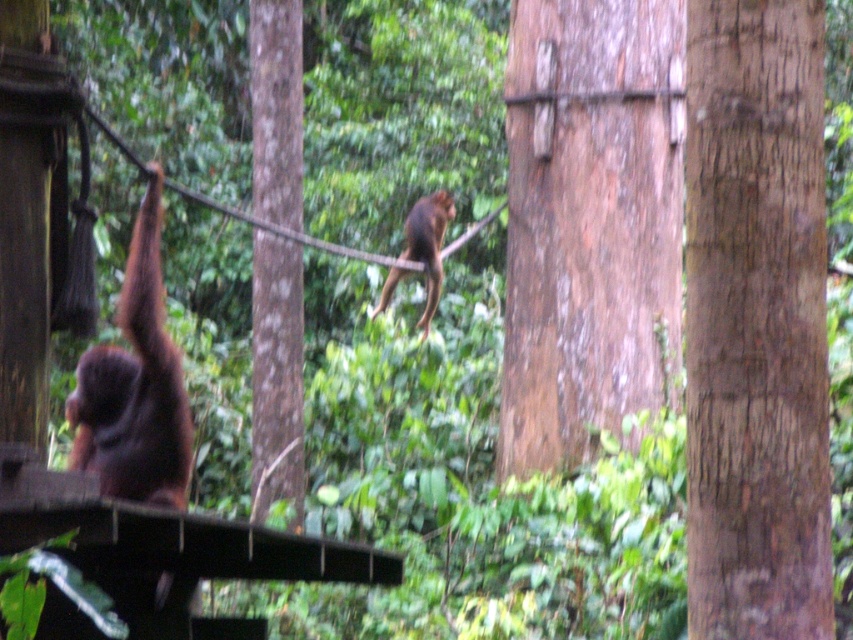
Question: Is smooth brown tree trunk at center positioned in front of brown furry monkey at left?

Choices:
 (A) no
 (B) yes

Answer: (A)

Question: Does brown rough bark at center appear on the left side of smooth brown tree trunk at center?

Choices:
 (A) no
 (B) yes

Answer: (B)

Question: Is brown furry monkey at left to the left of brown furry monkey at center from the viewer's perspective?

Choices:
 (A) no
 (B) yes

Answer: (B)

Question: Among these objects, which one is nearest to the camera?

Choices:
 (A) brown rough tree trunk at center
 (B) brown furry monkey at center
 (C) brown rough bark at center
 (D) brown furry monkey at left

Answer: (C)

Question: Which object is positioned farthest from the brown rough bark at center?

Choices:
 (A) brown rough tree trunk at center
 (B) smooth brown tree trunk at center
 (C) brown furry monkey at left

Answer: (A)

Question: Which object is the closest to the brown rough tree trunk at center?

Choices:
 (A) brown furry monkey at left
 (B) brown rough bark at center
 (C) brown furry monkey at center

Answer: (C)